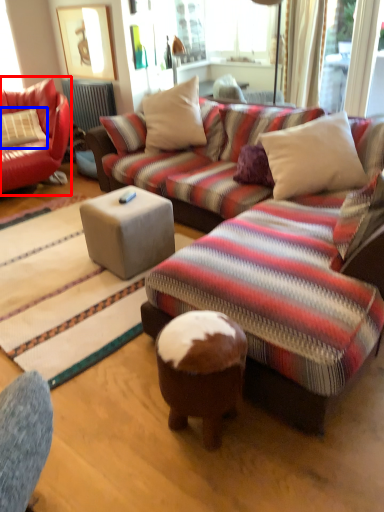
Question: Which object is further to the camera taking this photo, studio couch (highlighted by a red box) or pillow (highlighted by a blue box)?

Choices:
 (A) studio couch
 (B) pillow

Answer: (B)